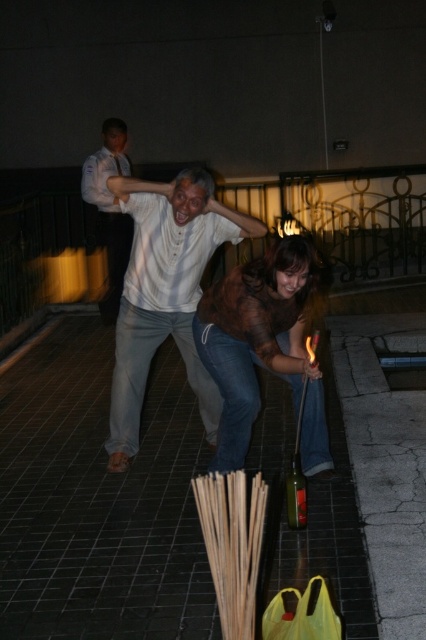
Question: Is white matte shirt at center closer to camera compared to matte brown sweater at center?

Choices:
 (A) yes
 (B) no

Answer: (B)

Question: Which point appears farthest from the camera in this image?

Choices:
 (A) (138, 285)
 (B) (109, 193)

Answer: (B)

Question: Which point appears farthest from the camera in this image?

Choices:
 (A) (304, 412)
 (B) (137, 403)

Answer: (B)

Question: Can you confirm if matte brown sweater at center is positioned to the right of white shirt at upper center?

Choices:
 (A) yes
 (B) no

Answer: (A)

Question: Among these objects, which one is nearest to the camera?

Choices:
 (A) white matte shirt at center
 (B) matte brown sweater at center
 (C) white shirt at upper center

Answer: (B)

Question: Is white matte shirt at center to the right of matte brown sweater at center from the viewer's perspective?

Choices:
 (A) yes
 (B) no

Answer: (B)